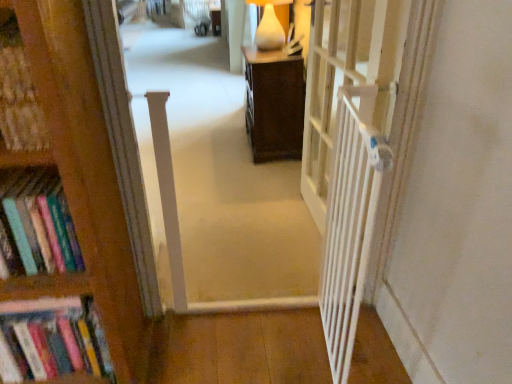
Question: In the image, is white matte table lamp at upper center on the left side or the right side of white wooden gate at right?

Choices:
 (A) right
 (B) left

Answer: (B)

Question: Choose the correct answer: Is white matte table lamp at upper center inside white wooden gate at right or outside it?

Choices:
 (A) outside
 (B) inside

Answer: (A)

Question: Estimate the real-world distances between objects in this image. Which object is farther from the hardcover books at left?

Choices:
 (A) white wooden gate at right
 (B) white matte table lamp at upper center
 (C) white plastic gate at right
 (D) white plastic gate at center

Answer: (B)

Question: Which of these objects is positioned closest to the white matte table lamp at upper center?

Choices:
 (A) white wooden gate at right
 (B) white plastic gate at center
 (C) hardcover books at left
 (D) white plastic gate at right

Answer: (D)